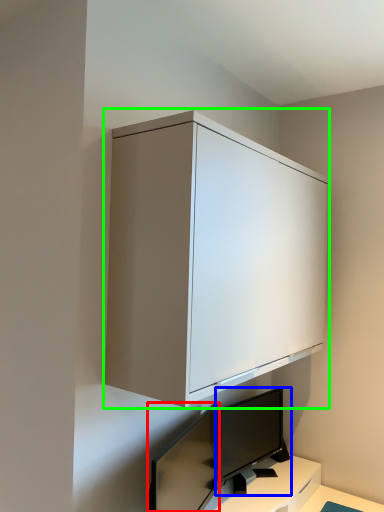
Question: Estimate the real-world distances between objects in this image. Which object is farther from computer monitor (highlighted by a red box), computer monitor (highlighted by a blue box) or cabinetry (highlighted by a green box)?

Choices:
 (A) computer monitor
 (B) cabinetry

Answer: (B)